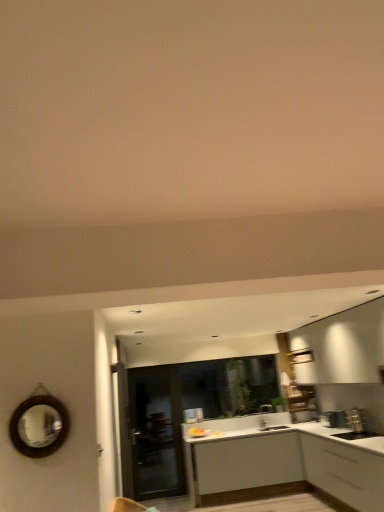
Question: Visually, is white matte cabinet at lower right, the 2th cabinetry positioned from the back, positioned to the left or to the right of white matte cabinet at center, marked as the second cabinetry in a front-to-back arrangement?

Choices:
 (A) left
 (B) right

Answer: (B)

Question: Is point (350, 448) positioned closer to the camera than point (312, 429)?

Choices:
 (A) closer
 (B) farther

Answer: (A)

Question: Based on their relative distances, which object is nearer to the silver metallic faucet at center?

Choices:
 (A) white matte cabinet at center, marked as the second cabinetry in a front-to-back arrangement
 (B) transparent glass door at center
 (C) white matte cabinet at lower right, marked as the 1th cabinetry in a front-to-back arrangement
 (D) matte black door at center
 (E) brown wooden mirror at left

Answer: (A)

Question: Based on their relative distances, which object is nearer to the white matte cabinet at center, the first cabinetry when ordered from back to front?

Choices:
 (A) matte black door at center
 (B) silver metallic faucet at center
 (C) white matte cabinet at lower right, the 2th cabinetry positioned from the back
 (D) transparent glass door at center
 (E) brown wooden mirror at left

Answer: (C)